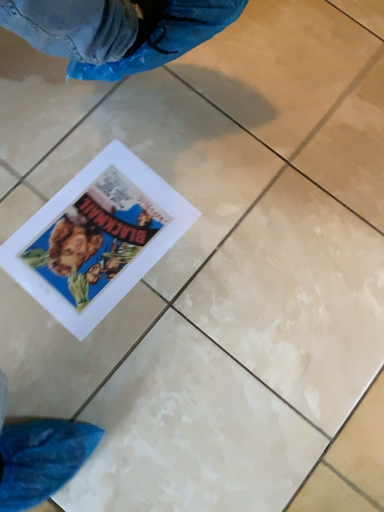
Locate an element on the screen. free space to the back side of blue matte poster at center is located at coordinates [x=148, y=124].